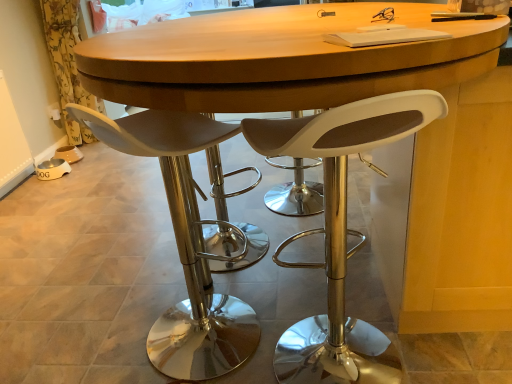
Question: Would you consider white matte stool at center, which is the second chair from left to right, to be distant from white matte stool at center, arranged as the first chair when viewed from the left?

Choices:
 (A) no
 (B) yes

Answer: (A)

Question: Can you confirm if white matte stool at center, which is the second chair from left to right, is thinner than white matte stool at center, arranged as the first chair when viewed from the left?

Choices:
 (A) yes
 (B) no

Answer: (B)

Question: From a real-world perspective, is white matte stool at center, which is the first chair from right to left, on top of white matte stool at center, arranged as the first chair when viewed from the left?

Choices:
 (A) no
 (B) yes

Answer: (B)

Question: From the image's perspective, is white matte stool at center, which is the first chair from right to left, located beneath white matte stool at center, acting as the second chair starting from the right?

Choices:
 (A) yes
 (B) no

Answer: (A)

Question: Can you confirm if white matte stool at center, which is the first chair from right to left, is wider than white matte stool at center, arranged as the first chair when viewed from the left?

Choices:
 (A) no
 (B) yes

Answer: (B)

Question: Considering the relative sizes of white matte stool at center, which is the first chair from right to left, and white matte stool at center, arranged as the first chair when viewed from the left, in the image provided, is white matte stool at center, which is the first chair from right to left, bigger than white matte stool at center, arranged as the first chair when viewed from the left,?

Choices:
 (A) yes
 (B) no

Answer: (A)

Question: Could you tell me if yellow floral fabric at left is facing white matte stool at center, which is the first chair from right to left?

Choices:
 (A) yes
 (B) no

Answer: (B)

Question: Is yellow floral fabric at left closer to camera compared to white matte stool at center, which is the first chair from right to left?

Choices:
 (A) no
 (B) yes

Answer: (A)

Question: Is yellow floral fabric at left positioned far away from white matte stool at center, which is the second chair from left to right?

Choices:
 (A) no
 (B) yes

Answer: (B)

Question: Would you say yellow floral fabric at left is outside white matte stool at center, which is the second chair from left to right?

Choices:
 (A) no
 (B) yes

Answer: (B)

Question: From the image's perspective, does yellow floral fabric at left appear higher than white matte stool at center, which is the second chair from left to right?

Choices:
 (A) yes
 (B) no

Answer: (A)

Question: Is yellow floral fabric at left in contact with white matte stool at center, which is the first chair from right to left?

Choices:
 (A) yes
 (B) no

Answer: (B)

Question: Considering the relative positions of white matte stool at center, acting as the second chair starting from the right, and white matte stool at center, which is the second chair from left to right, in the image provided, is white matte stool at center, acting as the second chair starting from the right, in front of white matte stool at center, which is the second chair from left to right,?

Choices:
 (A) yes
 (B) no

Answer: (B)